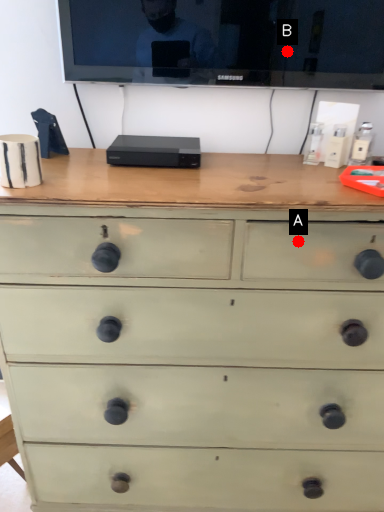
Question: Two points are circled on the image, labeled by A and B beside each circle. Which point is farther from the camera taking this photo?

Choices:
 (A) A is further
 (B) B is further

Answer: (B)